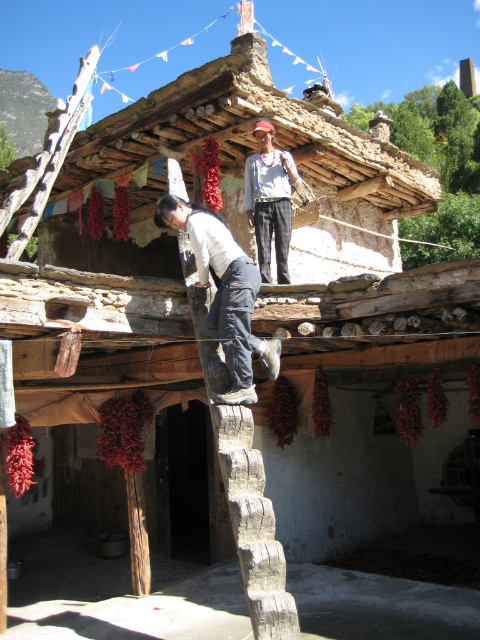
You are a photographer trying to capture a photo of the two people on the porch. You want to ensure both the black matte pants at center and the white cotton shirt at upper center are clearly visible. Which object should you focus on first to ensure proper alignment?

You should focus on the black matte pants at center first since it is positioned on the left side of the white cotton shirt at upper center, so aligning the leftmost element first ensures both are in frame.

You are standing at the point marked as point (233,378) in the image. You want to walk to the wooden ladder. Is the wooden ladder located to your left or right side?

The wooden ladder is located to the left side of point (233,378).